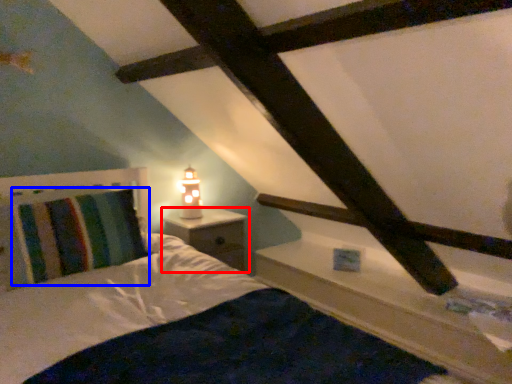
Question: Which of the following is the farthest to the observer, nightstand (highlighted by a red box) or pillow (highlighted by a blue box)?

Choices:
 (A) nightstand
 (B) pillow

Answer: (A)